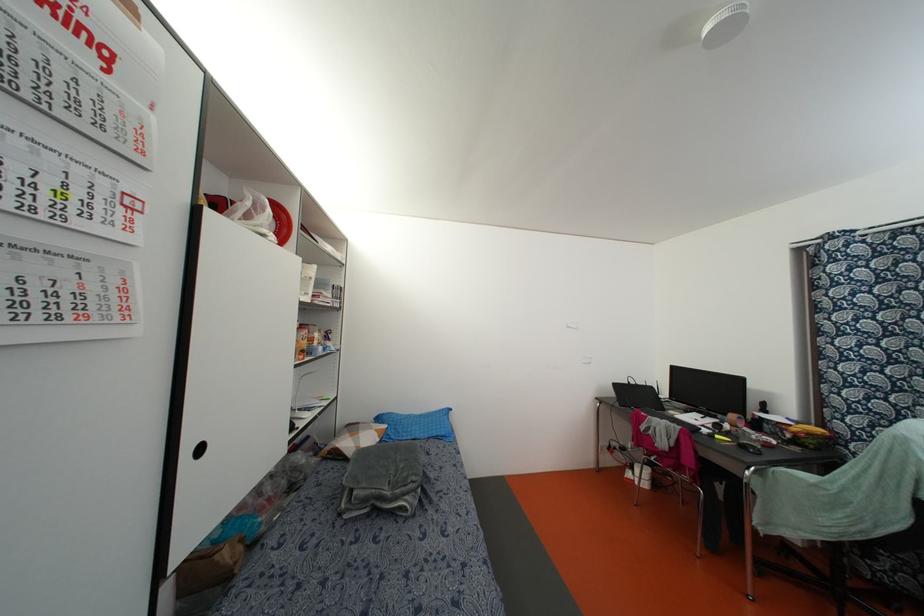
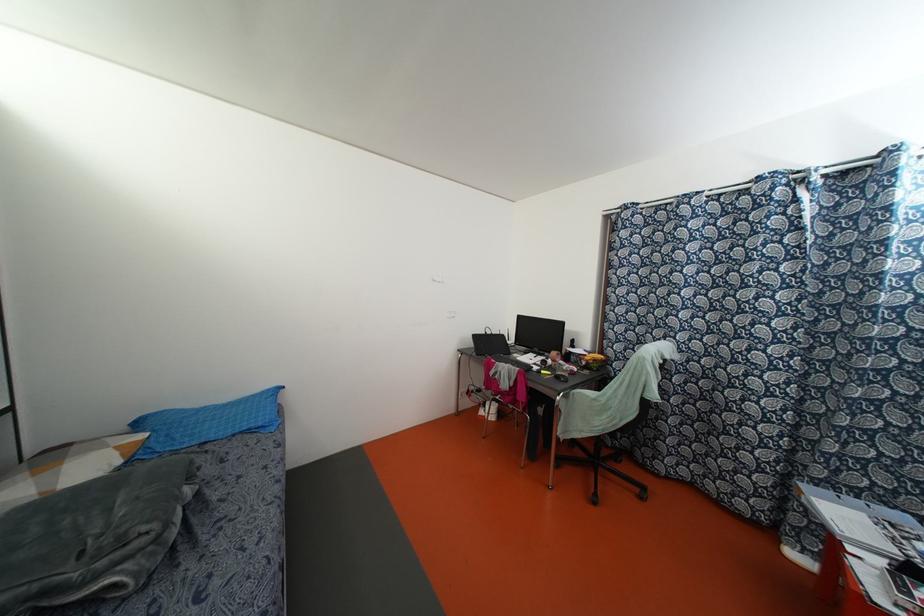
Question: Based on the continuous images, in which direction is the camera rotating? Reply with the corresponding letter.

Choices:
 (A) Left
 (B) Right
 (C) Up
 (D) Down

Answer: (B)